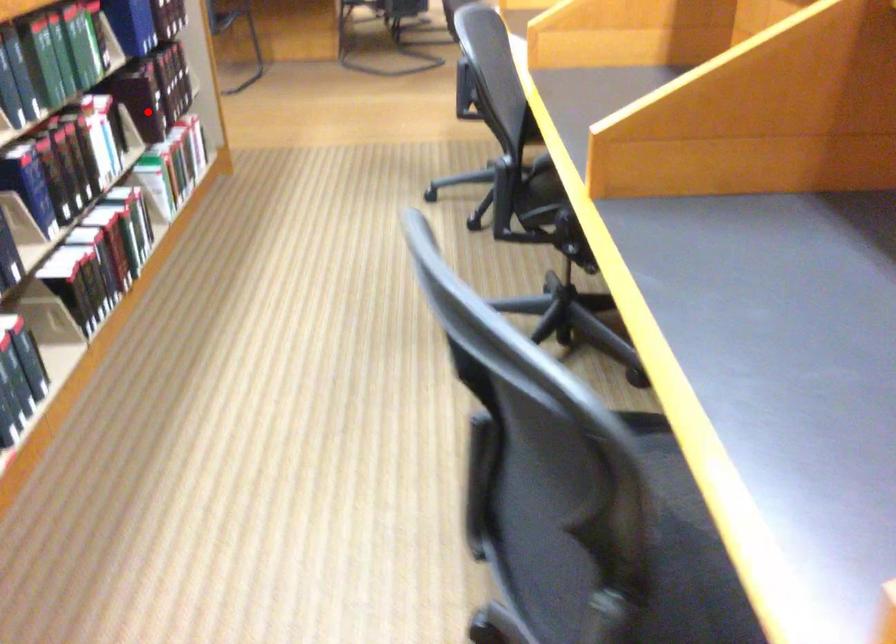
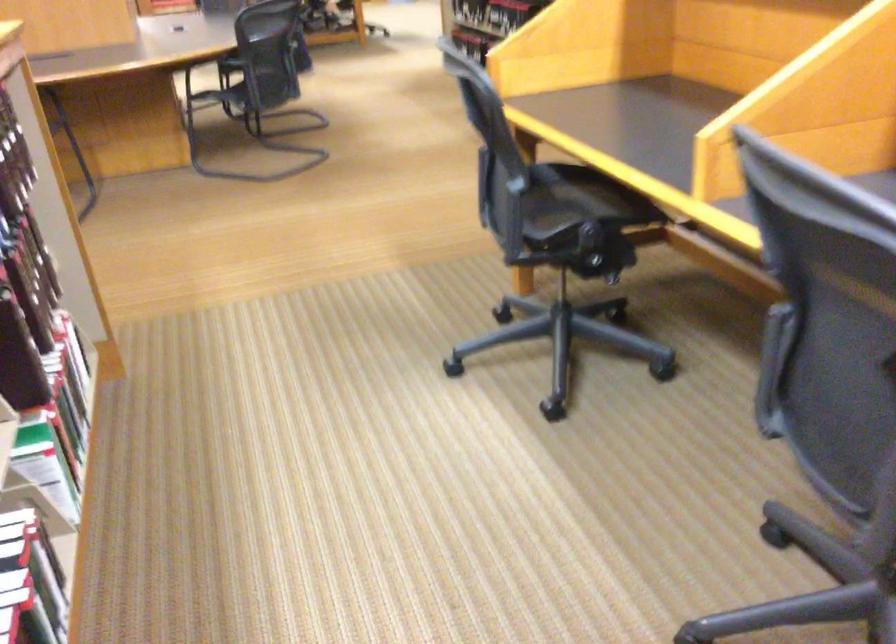
Where in the second image is the point corresponding to the highlighted location from the first image?

(19, 359)